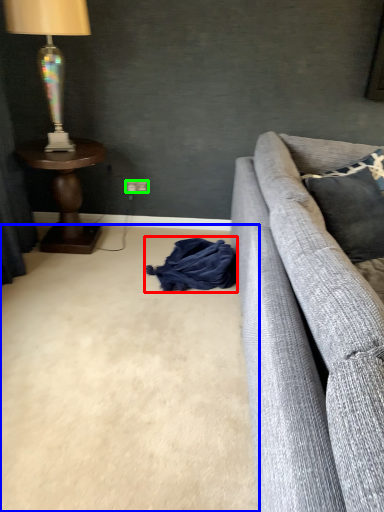
Question: Considering the real-world distances, which object is closest to material (highlighted by a red box)? plain (highlighted by a blue box) or power outlet (highlighted by a green box).

Choices:
 (A) plain
 (B) power outlet

Answer: (A)